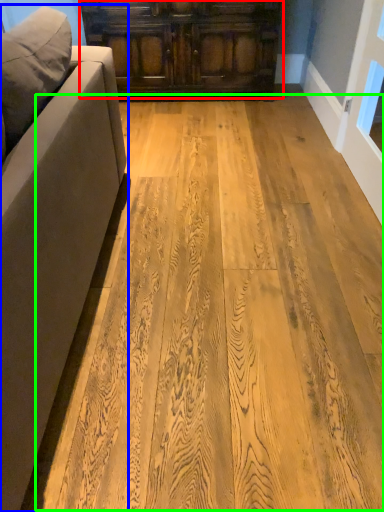
Question: Which object is positioned farthest from cabinetry (highlighted by a red box)? Select from studio couch (highlighted by a blue box) and plywood (highlighted by a green box).

Choices:
 (A) studio couch
 (B) plywood

Answer: (A)